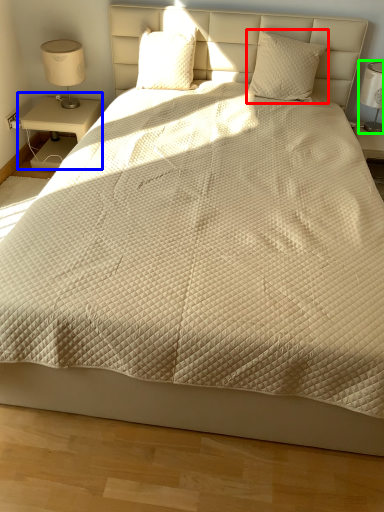
Question: Considering the real-world distances, which object is closest to pillow (highlighted by a red box)? nightstand (highlighted by a blue box) or bedside lamp (highlighted by a green box).

Choices:
 (A) nightstand
 (B) bedside lamp

Answer: (B)